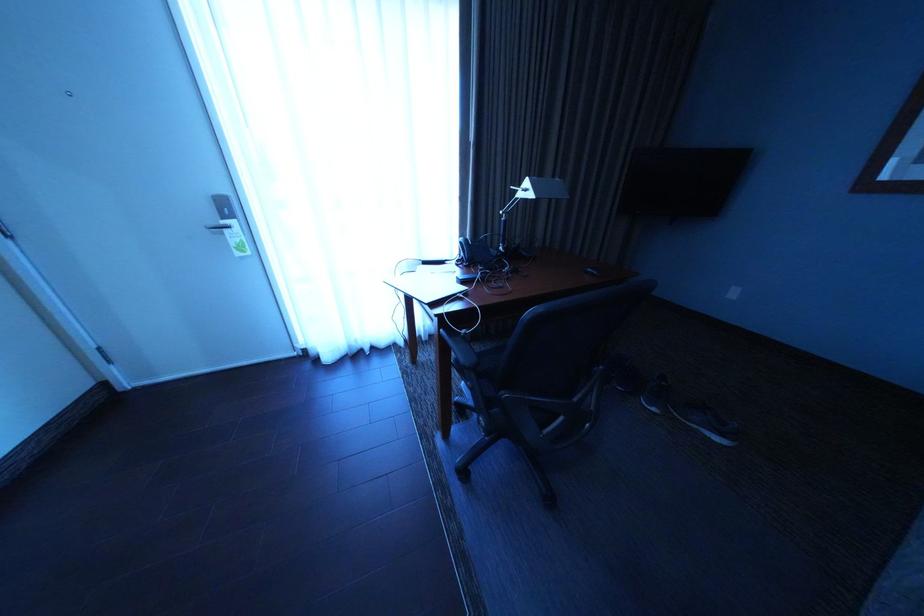
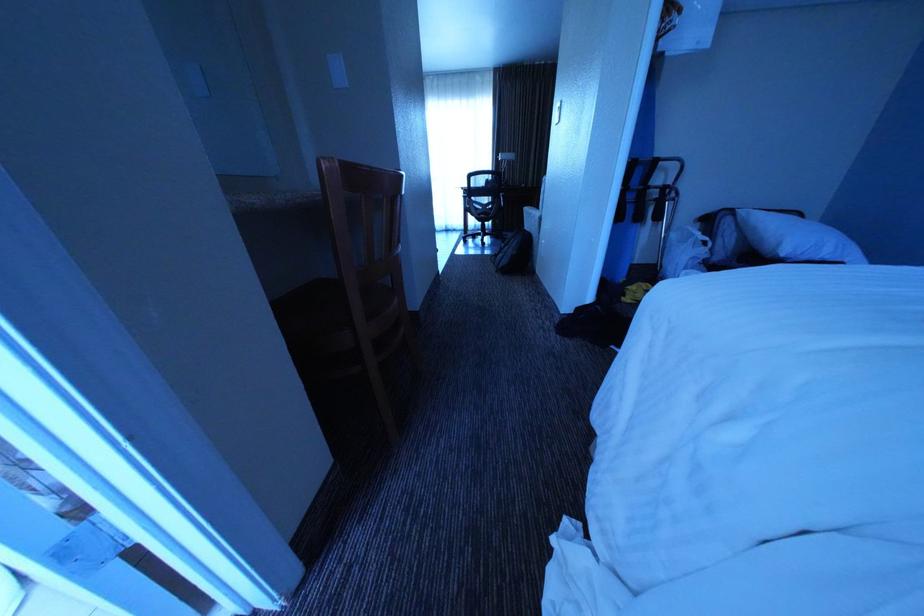
The images are taken continuously from a first-person perspective. In which direction are you moving?

The cameraman walked toward right, backward.